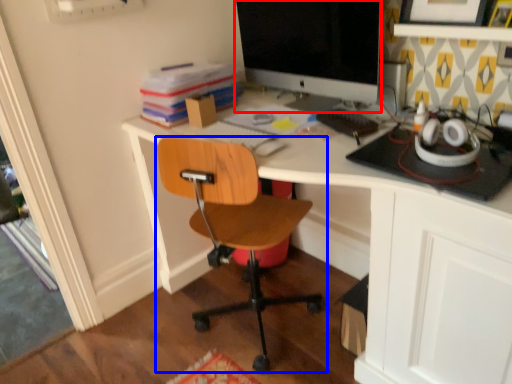
Question: Which object is further to the camera taking this photo, computer monitor (highlighted by a red box) or chair (highlighted by a blue box)?

Choices:
 (A) computer monitor
 (B) chair

Answer: (A)